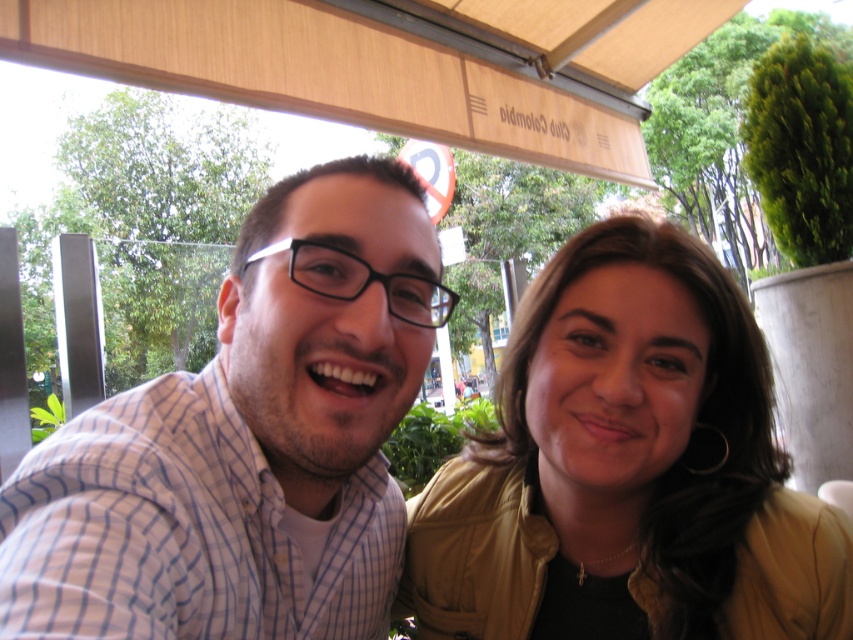
You are standing in the park and see the man with the checkered fabric shirt at center and the red circular sign with white arrow pointing to the left in the background. Which object is closer to the point at coordinates (247, 442)?

The checkered fabric shirt at center is located at point (247, 442), so it is exactly at that coordinate point, making it the closest to the point.

You are a tailor who needs to determine which piece of clothing requires more fabric to make between the checkered fabric shirt at center and the matte gold jacket at center. Based on the image, which one would need more fabric?

The checkered fabric shirt at center is larger in size than the matte gold jacket at center, so it would require more fabric to make.